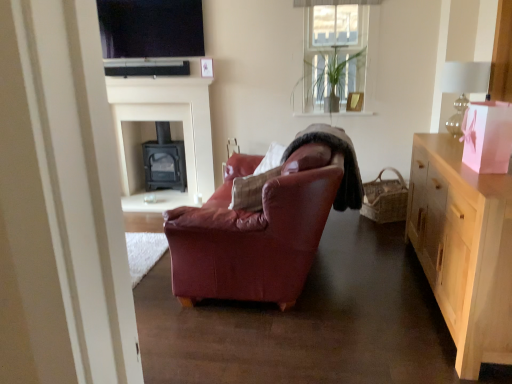
Where is `free point above black matte soundbar at upper center (from a real-world perspective)`? The height and width of the screenshot is (384, 512). free point above black matte soundbar at upper center (from a real-world perspective) is located at coordinates 147,62.